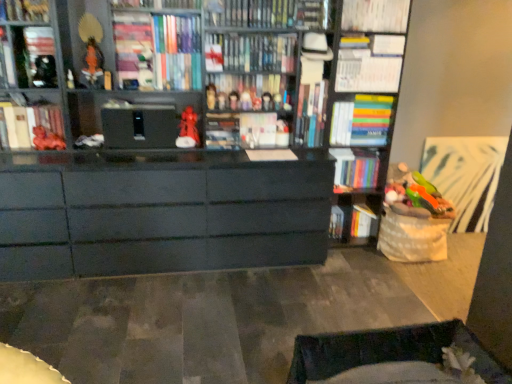
This screenshot has height=384, width=512. I want to click on white paper book at upper center, arranged as the ninth book when viewed from the left, so [x=370, y=64].

You are a GUI agent. You are given a task and a screenshot of the screen. Output one action in this format:
    pyautogui.click(x=<x>, y=<y>)
    Task: Click on the matte red figurine at center, the third toy when ordered from left to right
    Image resolution: width=512 pixels, height=384 pixels.
    Given the screenshot: What is the action you would take?
    pyautogui.click(x=188, y=129)

Describe the element at coordinates (258, 129) in the screenshot. I see `matte white paperback book at center, which appears as the 2th paperback book when viewed from the left` at that location.

This screenshot has height=384, width=512. What do you see at coordinates (355, 169) in the screenshot?
I see `hardcover book at center, the tenth book in the left-to-right sequence` at bounding box center [355, 169].

I want to click on hardcover book at center, the 6th book when ordered from left to right, so click(x=251, y=52).

Identify the location of white paper book at lower right, the 1th book when ordered from right to left. Image resolution: width=512 pixels, height=384 pixels. (362, 221).

Find the location of a particular element. the 10th book behind the metallic silver figurine at upper left, arranged as the second toy when viewed from the left is located at coordinates (355, 169).

Is the position of hardcover book at center, the tenth book in the left-to-right sequence, less distant than that of metallic silver figurine at upper left, positioned as the 6th toy in right-to-left order?

No, it is behind metallic silver figurine at upper left, positioned as the 6th toy in right-to-left order.

Can you confirm if hardcover book at center, the 4th book when ordered from right to left, is thinner than metallic silver figurine at upper left, positioned as the 6th toy in right-to-left order?

Indeed, hardcover book at center, the 4th book when ordered from right to left, has a lesser width compared to metallic silver figurine at upper left, positioned as the 6th toy in right-to-left order.

Which is behind, point (357, 184) or point (33, 83)?

The point (357, 184) is more distant.

Would you say matte red figurine at center, the 4th toy positioned from the right, is inside or outside hardcover book at center, the 6th book when ordered from left to right?

matte red figurine at center, the 4th toy positioned from the right, is located beyond the bounds of hardcover book at center, the 6th book when ordered from left to right.

Which object is positioned more to the right, matte red figurine at center, the 4th toy positioned from the right, or hardcover book at center, the 6th book when ordered from left to right?

hardcover book at center, the 6th book when ordered from left to right.

From the image's perspective, is matte red figurine at center, arranged as the 4th toy when viewed from the left, beneath hardcover book at center, the 6th book when ordered from left to right?

Yes, from the image's perspective, matte red figurine at center, arranged as the 4th toy when viewed from the left, is below hardcover book at center, the 6th book when ordered from left to right.

Does matte red figurine at center, arranged as the 4th toy when viewed from the left, have a lesser width compared to hardcover book at center, the 6th book when ordered from left to right?

Indeed, matte red figurine at center, arranged as the 4th toy when viewed from the left, has a lesser width compared to hardcover book at center, the 6th book when ordered from left to right.

Is hardcover book at center, the 6th book when ordered from left to right, oriented away from white paper at upper center, the 11th book when ordered from left to right?

hardcover book at center, the 6th book when ordered from left to right, does not have its back to white paper at upper center, the 11th book when ordered from left to right.

The height and width of the screenshot is (384, 512). What are the coordinates of `the 5th book counting from the left of the white paper at upper center, the 3th book in the right-to-left sequence` in the screenshot? It's located at (251, 52).

Is hardcover book at center, the 6th book when ordered from left to right, wider or thinner than white paper at upper center, the 3th book in the right-to-left sequence?

Clearly, hardcover book at center, the 6th book when ordered from left to right, has less width compared to white paper at upper center, the 3th book in the right-to-left sequence.

Could you measure the distance between matte red figurine at center, the 6th toy viewed from the left, and matte red figurine at center, the fifth toy positioned from the right?

matte red figurine at center, the 6th toy viewed from the left, and matte red figurine at center, the fifth toy positioned from the right, are 30.07 centimeters apart from each other.

From the image's perspective, between matte red figurine at center, the 6th toy viewed from the left, and matte red figurine at center, the fifth toy positioned from the right, which one is located above?

matte red figurine at center, the 6th toy viewed from the left, appears higher in the image.

Does matte red figurine at center, which is the second toy in right-to-left order, appear on the right side of matte red figurine at center, the fifth toy positioned from the right?

Correct, you'll find matte red figurine at center, which is the second toy in right-to-left order, to the right of matte red figurine at center, the fifth toy positioned from the right.

From the image's perspective, which book is the 3rd one above the white paper book at upper center, marked as the fifth book in a right-to-left arrangement? Please provide its 2D coordinates.

[(24, 10)]

Does matte black bookshelf at upper left, which appears as the 11th book when viewed from the right, touch white paper book at upper center, arranged as the ninth book when viewed from the left?

No, matte black bookshelf at upper left, which appears as the 11th book when viewed from the right, is not in contact with white paper book at upper center, arranged as the ninth book when viewed from the left.

From the image's perspective, would you say matte black bookshelf at upper left, positioned as the 3th book in left-to-right order, is positioned over white paper book at upper center, arranged as the ninth book when viewed from the left?

Yes.

Considering the relative positions of hardcover book at upper center, positioned as the 7th book in right-to-left order, and metallic silver figurine at upper left, positioned as the 6th toy in right-to-left order, in the image provided, is hardcover book at upper center, positioned as the 7th book in right-to-left order, to the left or to the right of metallic silver figurine at upper left, positioned as the 6th toy in right-to-left order,?

hardcover book at upper center, positioned as the 7th book in right-to-left order, is positioned on metallic silver figurine at upper left, positioned as the 6th toy in right-to-left order,'s right side.

In the scene shown: Which of these two, hardcover book at upper center, positioned as the 7th book in right-to-left order, or metallic silver figurine at upper left, positioned as the 6th toy in right-to-left order, is wider?

hardcover book at upper center, positioned as the 7th book in right-to-left order, is wider.

Which object is closer to the camera, hardcover book at upper center, positioned as the 7th book in right-to-left order, or metallic silver figurine at upper left, positioned as the 6th toy in right-to-left order?

metallic silver figurine at upper left, positioned as the 6th toy in right-to-left order, is closer to the camera.

Identify the location of the 6th book above the metallic silver figurine at upper left, positioned as the 6th toy in right-to-left order (from the image's perspective). The width and height of the screenshot is (512, 384). (269, 14).

Is matte orange figurine at left, placed as the 7th toy when sorted from right to left, to the left or to the right of matte red figurine at center, the third toy when ordered from left to right, in the image?

Clearly, matte orange figurine at left, placed as the 7th toy when sorted from right to left, is on the left of matte red figurine at center, the third toy when ordered from left to right, in the image.

Is matte orange figurine at left, placed as the 7th toy when sorted from right to left, oriented towards matte red figurine at center, the third toy when ordered from left to right?

No, matte orange figurine at left, placed as the 7th toy when sorted from right to left, is not turned towards matte red figurine at center, the third toy when ordered from left to right.

Which of these two, matte orange figurine at left, which ranks as the first toy in left-to-right order, or matte red figurine at center, the fifth toy positioned from the right, is smaller?

Smaller between the two is matte orange figurine at left, which ranks as the first toy in left-to-right order.

From the image's perspective, is matte orange figurine at left, which ranks as the first toy in left-to-right order, located beneath matte red figurine at center, the fifth toy positioned from the right?

Yes, from the image's perspective, matte orange figurine at left, which ranks as the first toy in left-to-right order, is beneath matte red figurine at center, the fifth toy positioned from the right.

At what (x,y) coordinates should I click in order to perform the action: click on book that is the 4th object located below the metallic silver figurine at upper left, positioned as the 6th toy in right-to-left order (from the image's perspective). Please return your answer as a coordinate pair (x, y). Looking at the image, I should click on (355, 169).

From a real-world perspective, count 5th books upward from the matte red figurine at center, arranged as the 4th toy when viewed from the left, and point to it. Please provide its 2D coordinates.

[(251, 52)]

Estimate the real-world distances between objects in this image. Which object is closer to matte black bookcase at center, hardcover book at center, the 6th book when ordered from left to right, or matte red figurine at center, the 4th toy positioned from the right?

Based on the image, hardcover book at center, the 6th book when ordered from left to right, appears to be nearer to matte black bookcase at center.

From the image, which object appears to be farther from hardcover book at center, the 6th book when ordered from left to right, matte white paperback book at center, which is the 1th paperback book in right-to-left order, or white paper at upper center, the 11th book when ordered from left to right?

white paper at upper center, the 11th book when ordered from left to right, is further to hardcover book at center, the 6th book when ordered from left to right.

Based on their spatial positions, is hardcover book at upper center, positioned as the 7th book in right-to-left order, or matte red figurine at center, the 6th toy viewed from the left, closer to hardcover book at center, the tenth book in the left-to-right sequence?

Among the two, matte red figurine at center, the 6th toy viewed from the left, is located nearer to hardcover book at center, the tenth book in the left-to-right sequence.

In the scene shown: Looking at the image, which one is located closer to matte plastic figurine at center, acting as the seventh toy starting from the left, matte black book at upper left, the thirteenth book positioned from the right, or matte black bookshelf at upper left, which appears as the 11th book when viewed from the right?

matte black bookshelf at upper left, which appears as the 11th book when viewed from the right, lies closer to matte plastic figurine at center, acting as the seventh toy starting from the left, than the other object.

Estimate the real-world distances between objects in this image. Which object is further from white paper book at upper center, arranged as the ninth book when viewed from the left, matte red figurine at center, which appears as the 3th toy when viewed from the right, or matte black bookshelf at upper left, arranged as the 4th book when viewed from the left?

Based on the image, matte black bookshelf at upper left, arranged as the 4th book when viewed from the left, appears to be further to white paper book at upper center, arranged as the ninth book when viewed from the left.

Looking at the image, which one is located closer to satin doll at center, which ranks as the ninth book in right-to-left order, white paper book at upper center, arranged as the ninth book when viewed from the left, or matte white paperback book at center, which appears as the 2th paperback book when viewed from the left?

Among the two, matte white paperback book at center, which appears as the 2th paperback book when viewed from the left, is located nearer to satin doll at center, which ranks as the ninth book in right-to-left order.

When comparing their distances from matte black book at upper left, the thirteenth book positioned from the right, does matte black bookshelf at upper left, which appears as the 11th book when viewed from the right, or hardcover book at center, which is the 8th book from right to left, seem closer?

matte black bookshelf at upper left, which appears as the 11th book when viewed from the right.

Which object lies further to the anchor point matte white book at left, positioned as the 2th book in left-to-right order, hardcover book at center, which is the 8th book in left-to-right order, or hardcover book at center, which is the 8th book from right to left?

hardcover book at center, which is the 8th book in left-to-right order, is positioned further to the anchor matte white book at left, positioned as the 2th book in left-to-right order.

Identify the location of paperback book between matte black bookcase at center and matte white paperback book at center, which is the 1th paperback book in right-to-left order, along the z-axis. (222, 131).

Where is `paperback book between matte white book at left, marked as the twelfth book in a right-to-left arrangement, and matte white paperback book at center, which is the 1th paperback book in right-to-left order, from left to right`? paperback book between matte white book at left, marked as the twelfth book in a right-to-left arrangement, and matte white paperback book at center, which is the 1th paperback book in right-to-left order, from left to right is located at coordinates (222, 131).

I want to click on paperback book located between matte red figurine at center, the 6th toy viewed from the left, and matte plastic figurine at center, acting as the seventh toy starting from the left, in the left-right direction, so pos(258,129).

This screenshot has height=384, width=512. Identify the location of paperback book situated between matte black bookshelf at upper left, arranged as the 4th book when viewed from the left, and hardcover book at center, which is the 8th book from right to left, from left to right. (222, 131).